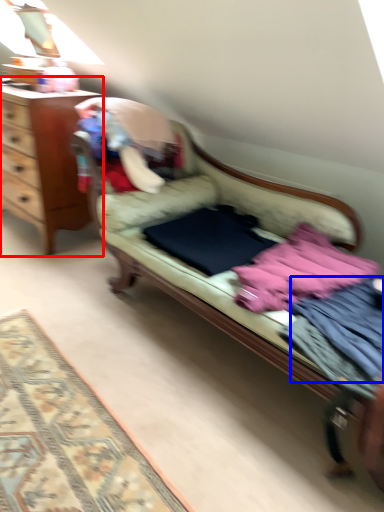
Question: Which object is further to the camera taking this photo, desk (highlighted by a red box) or clothing (highlighted by a blue box)?

Choices:
 (A) desk
 (B) clothing

Answer: (A)